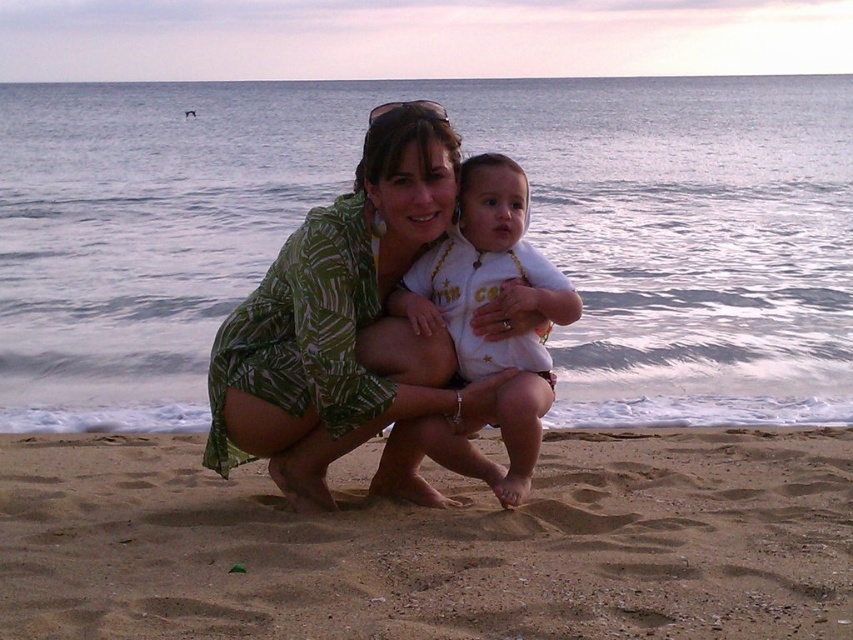
Question: Estimate the real-world distances between objects in this image. Which object is closer to the green leaf-patterned dress at center?

Choices:
 (A) fine-grained sand at lower center
 (B) white cotton onesie at center

Answer: (B)

Question: Can you confirm if fine-grained sand at lower center is wider than green leaf-patterned dress at center?

Choices:
 (A) yes
 (B) no

Answer: (A)

Question: Is fine-grained sand at lower center positioned behind green leaf-patterned dress at center?

Choices:
 (A) no
 (B) yes

Answer: (A)

Question: Which of the following is the farthest from the observer?

Choices:
 (A) (543, 397)
 (B) (815, 452)
 (C) (363, 250)

Answer: (B)

Question: Is fine-grained sand at lower center bigger than white cotton onesie at center?

Choices:
 (A) yes
 (B) no

Answer: (A)

Question: Which point is farther from the camera taking this photo?

Choices:
 (A) (303, 225)
 (B) (471, 180)

Answer: (B)